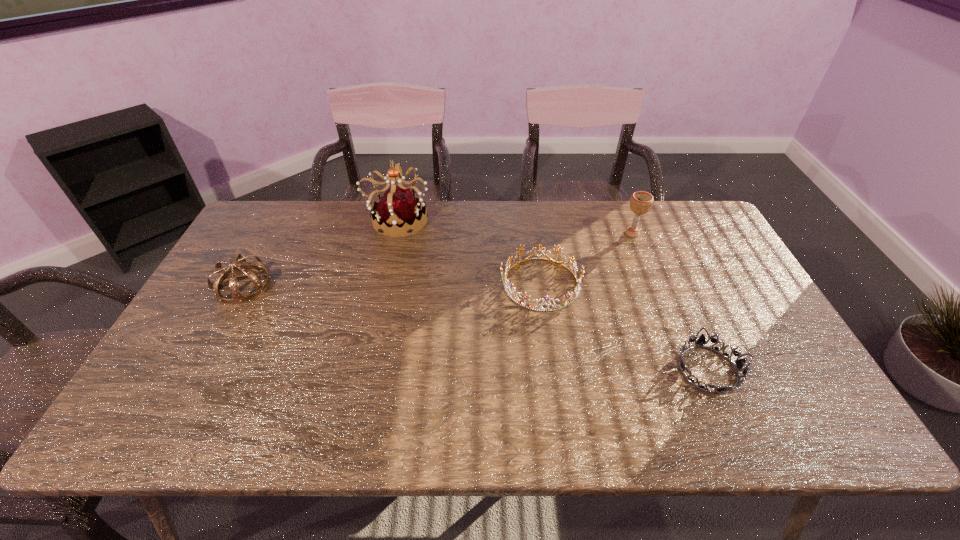
You are a GUI agent. You are given a task and a screenshot of the screen. Output one action in this format:
    pyautogui.click(x=<x>, y=<y>)
    Task: Click on the free space between the fourth tallest object and the second tiara from left to right
    This screenshot has height=540, width=960.
    Given the screenshot: What is the action you would take?
    pyautogui.click(x=468, y=252)

Identify the location of blank region between the farthest tiara and the fourth shortest object. The image size is (960, 540). (515, 227).

This screenshot has width=960, height=540. Identify the location of empty space that is in between the third object from left to right and the chalice. (587, 259).

This screenshot has height=540, width=960. In order to click on free point between the third object from right to left and the leftmost object in this screenshot , I will do `click(392, 285)`.

What are the coordinates of `vacant space in between the third tallest tiara and the second object from left to right` in the screenshot? It's located at (468, 252).

Locate an element on the screen. The image size is (960, 540). vacant space in between the chalice and the third tallest tiara is located at coordinates (587, 259).

Where is `free space between the shortest object and the chalice`? free space between the shortest object and the chalice is located at coordinates (670, 301).

Locate an element on the screen. Image resolution: width=960 pixels, height=540 pixels. object that is the fourth closest to the fourth object from right to left is located at coordinates (701, 341).

Image resolution: width=960 pixels, height=540 pixels. Find the location of `object that is the second closest to the second tiara from right to left`. object that is the second closest to the second tiara from right to left is located at coordinates (701, 341).

Identify which tiara is the nearest to the shortest tiara. Please provide its 2D coordinates. Your answer should be formatted as a tuple, i.e. [(x, y)], where the tuple contains the x and y coordinates of a point satisfying the conditions above.

[(569, 296)]